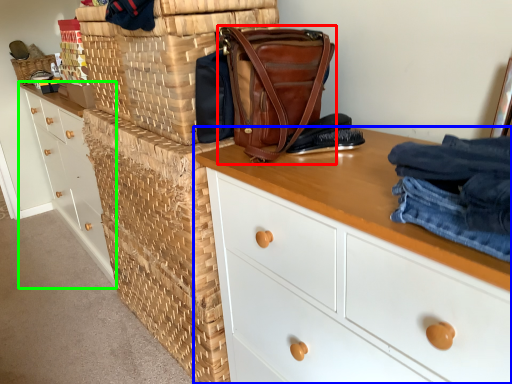
Question: Considering the real-world distances, which object is closest to handbag (highlighted by a red box)? chest of drawers (highlighted by a blue box) or chest of drawers (highlighted by a green box).

Choices:
 (A) chest of drawers
 (B) chest of drawers

Answer: (A)